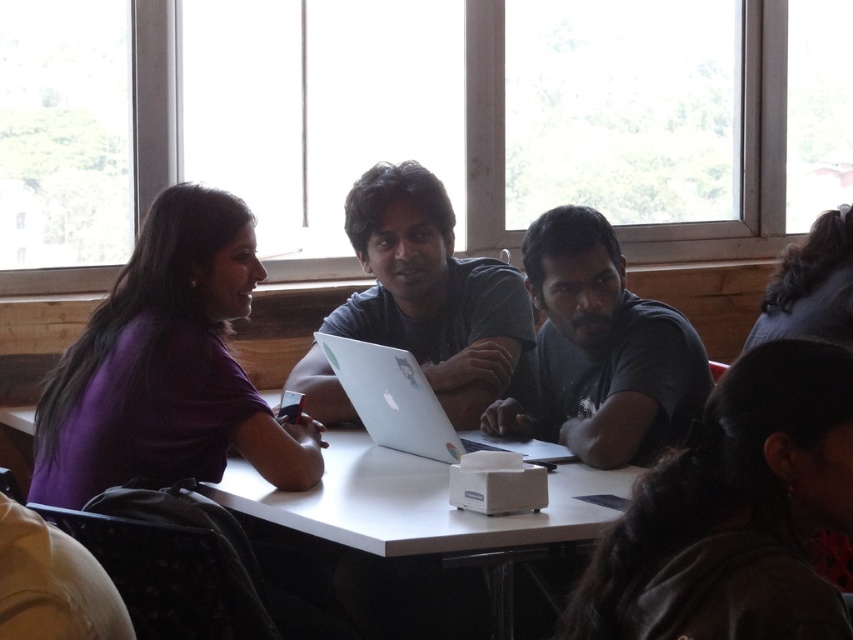
You are standing at the entrance of the room and want to locate the purple matte shirt at left. According to the coordinates provided, where should you look relative to the center of the image?

The purple matte shirt at left is located at coordinates point (166, 368), which is to the left and slightly below the center of the image.

You are a person who needs to reach the satin gray laptop at center from your current position near the dark gray shirt at lower right. The laptop is 1.49 meters away. If you can stretch your arm 1.5 meters, can you reach it without moving your feet?

The distance between dark gray shirt at lower right and satin gray laptop at center is 1.49 meters, which is less than your arm stretch of 1.5 meters. Therefore, you can reach the satin gray laptop at center without moving your feet.

You are attending a meeting and need to pass a document to the person wearing the dark gray shirt at lower right and the purple matte shirt at left. Considering their positions, which person is sitting closer to the table edge?

The dark gray shirt at lower right has a lesser height compared to the purple matte shirt at left, so the dark gray shirt at lower right is sitting closer to the table edge.